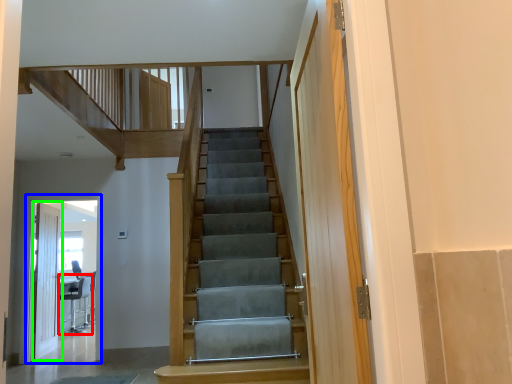
Question: Which object is the farthest from chair (highlighted by a red box)? Choose among these: elevator (highlighted by a blue box) or door (highlighted by a green box).

Choices:
 (A) elevator
 (B) door

Answer: (A)